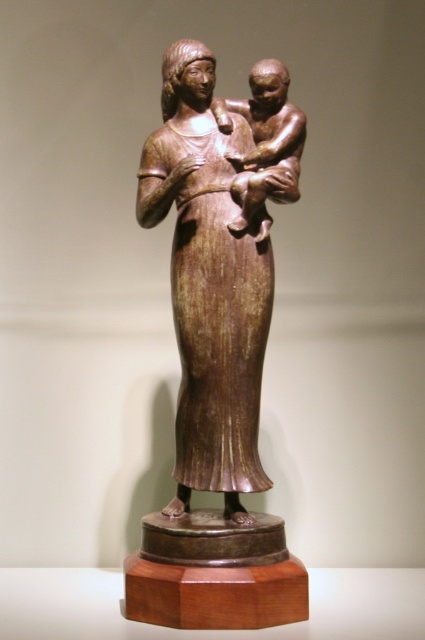
Question: Is bronze statue at center positioned at the back of bronze baby at center?

Choices:
 (A) no
 (B) yes

Answer: (A)

Question: Does bronze statue at center have a smaller size compared to bronze baby at center?

Choices:
 (A) no
 (B) yes

Answer: (A)

Question: Which object is closer to the camera taking this photo?

Choices:
 (A) bronze baby at center
 (B) bronze statue at center

Answer: (B)

Question: Does bronze statue at center appear under bronze baby at center?

Choices:
 (A) yes
 (B) no

Answer: (A)